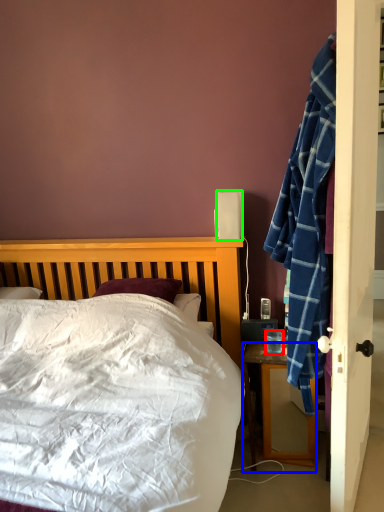
Question: Which object is positioned closest to coffee cup (highlighted by a red box)? Select from desk (highlighted by a blue box) and loudspeaker (highlighted by a green box).

Choices:
 (A) desk
 (B) loudspeaker

Answer: (A)